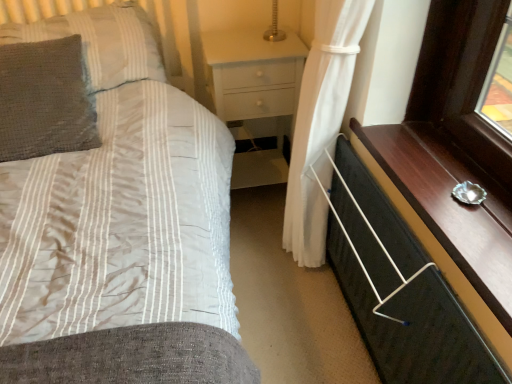
At what (x,y) coordinates should I click in order to perform the action: click on vacant space underneath white fabric curtain at lower right (from a real-world perspective). Please return your answer as a coordinate pair (x, y). This screenshot has width=512, height=384. Looking at the image, I should click on (312, 292).